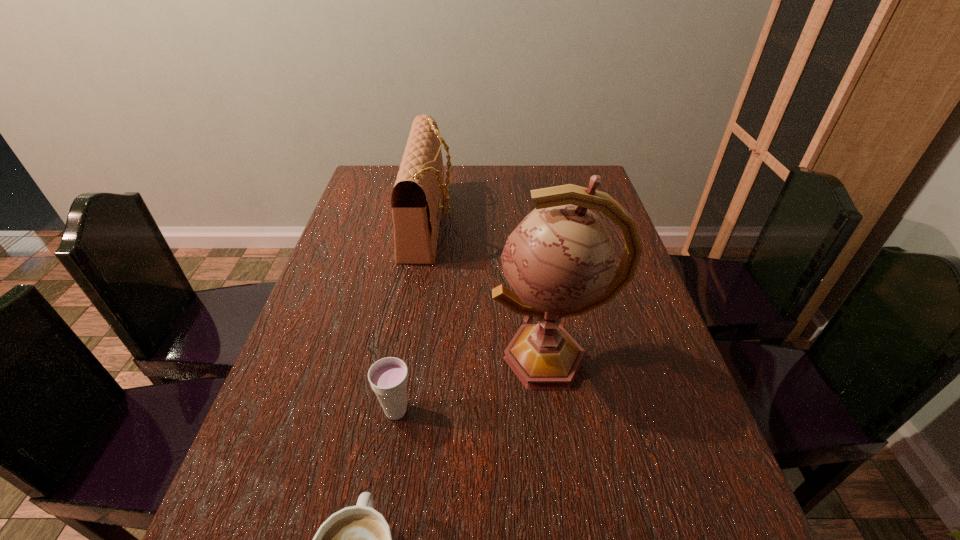
Locate an element on the screen. This screenshot has width=960, height=540. the rightmost object is located at coordinates (560, 261).

I want to click on globe, so click(560, 261).

The height and width of the screenshot is (540, 960). I want to click on handbag, so click(x=416, y=201).

Where is `the farthest object`? The width and height of the screenshot is (960, 540). the farthest object is located at coordinates (416, 201).

Where is `cup`? The image size is (960, 540). cup is located at coordinates [388, 377].

This screenshot has width=960, height=540. I want to click on free space located 0.120m on the front-facing side of the rightmost object, so click(436, 358).

Where is `blank space located on the front-facing side of the rightmost object`? The height and width of the screenshot is (540, 960). blank space located on the front-facing side of the rightmost object is located at coordinates (431, 358).

Identify the location of free space located on the front-facing side of the rightmost object. The width and height of the screenshot is (960, 540). (408, 358).

Identify the location of vacant point located 0.370m on the front-facing side of the farthest object. (574, 222).

The width and height of the screenshot is (960, 540). I want to click on free space located on the left of the cup, so click(342, 411).